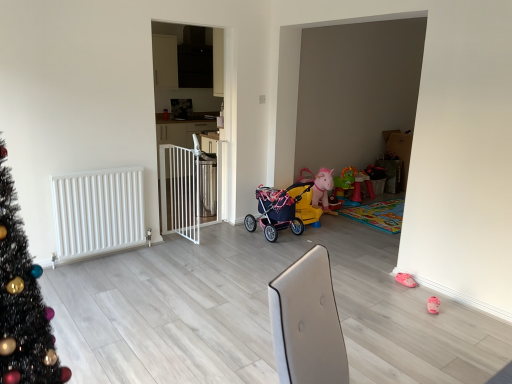
At what (x,y) coordinates should I click in order to perform the action: click on vacant area situated below white matte radiator at left (from a real-world perspective). Please return your answer as a coordinate pair (x, y). This screenshot has height=384, width=512. Looking at the image, I should click on (105, 256).